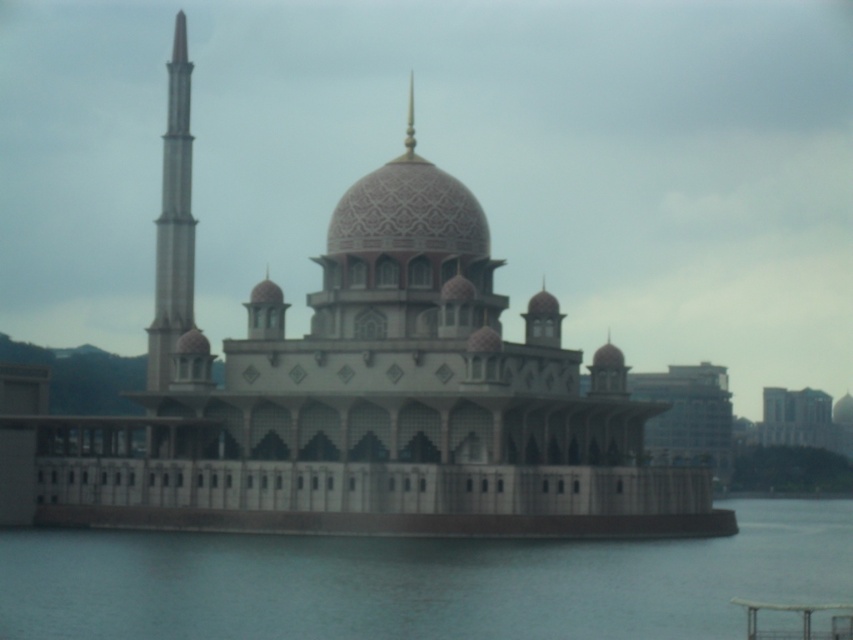
Which is more to the left, clear water at lower center or smooth concrete minaret at left?

From the viewer's perspective, smooth concrete minaret at left appears more on the left side.

Which of these two, clear water at lower center or smooth concrete minaret at left, stands taller?

With more height is smooth concrete minaret at left.

Looking at this image, who is more distant from viewer, (625, 584) or (178, 248)?

The point (178, 248) is more distant.

Where is `clear water at lower center`? This screenshot has height=640, width=853. clear water at lower center is located at coordinates 421,580.